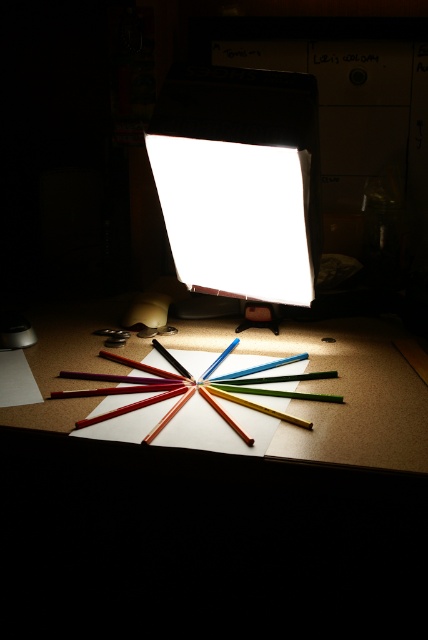
Is white matte lampshade at center to the left of wooden table at center from the viewer's perspective?

In fact, white matte lampshade at center is to the right of wooden table at center.

Can you confirm if white matte lampshade at center is thinner than wooden table at center?

Correct, white matte lampshade at center's width is less than wooden table at center's.

Where is `white matte lampshade at center`? The height and width of the screenshot is (640, 428). white matte lampshade at center is located at coordinates (240, 180).

Locate an element on the screen. Image resolution: width=428 pixels, height=640 pixels. white matte lampshade at center is located at coordinates (240, 180).